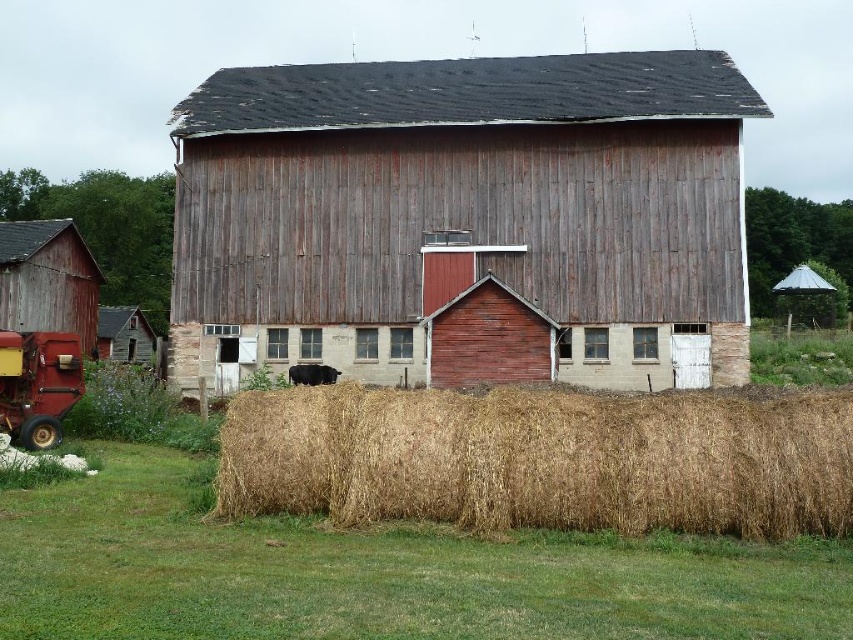
Who is positioned more to the left, brown straw bales at lower center or metallic red tractor at lower left?

From the viewer's perspective, metallic red tractor at lower left appears more on the left side.

Is brown straw bales at lower center to the left of metallic red tractor at lower left from the viewer's perspective?

No, brown straw bales at lower center is not to the left of metallic red tractor at lower left.

Is point (486, 417) more distant than point (68, 365)?

No, it is not.

Locate an element on the screen. This screenshot has width=853, height=640. brown straw bales at lower center is located at coordinates (543, 458).

Is the position of brown straw bales at lower center less distant than that of rustic wood barn at left?

Yes, brown straw bales at lower center is closer to the viewer.

Consider the image. Who is higher up, brown straw bales at lower center or rustic wood barn at left?

rustic wood barn at left

Is point (357, 467) closer to camera compared to point (13, 227)?

Yes, point (357, 467) is in front of point (13, 227).

Locate an element on the screen. Image resolution: width=853 pixels, height=640 pixels. brown straw bales at lower center is located at coordinates (543, 458).

Consider the image. Is wooden barn at center to the left of metallic red tractor at lower left from the viewer's perspective?

Incorrect, wooden barn at center is not on the left side of metallic red tractor at lower left.

Is point (746, 358) positioned in front of point (32, 332)?

No, (746, 358) is further to viewer.

Image resolution: width=853 pixels, height=640 pixels. Identify the location of wooden barn at center. (466, 220).